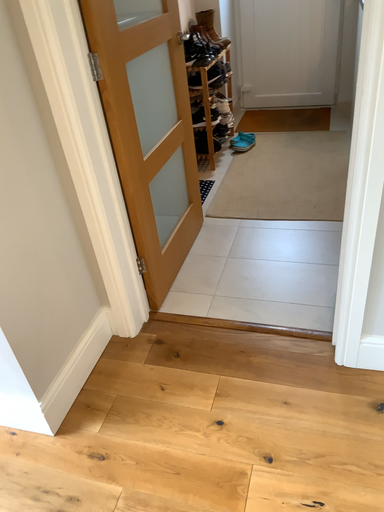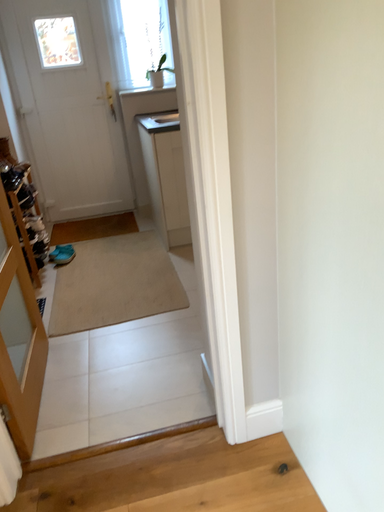
Question: How did the camera likely rotate when shooting the video?

Choices:
 (A) rotated left
 (B) rotated right

Answer: (B)